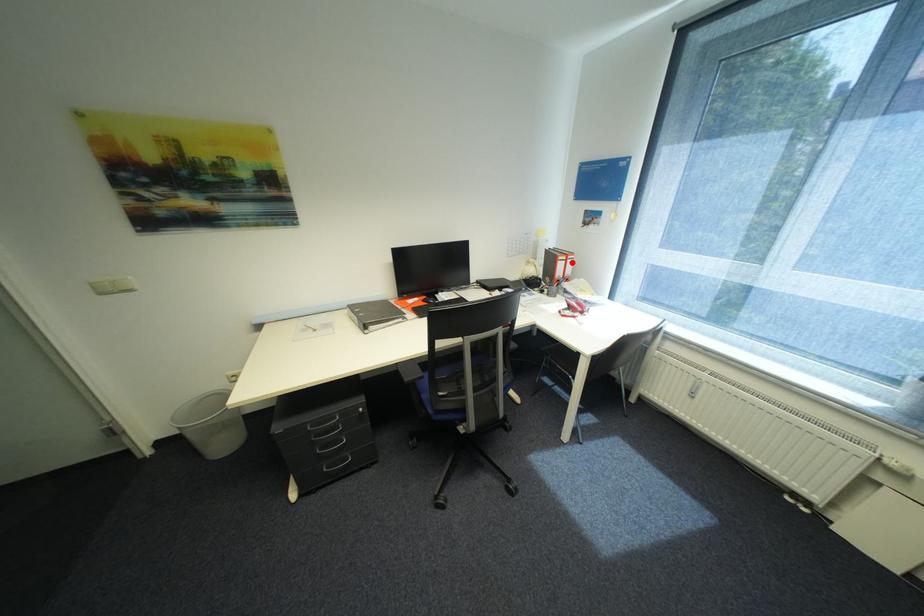
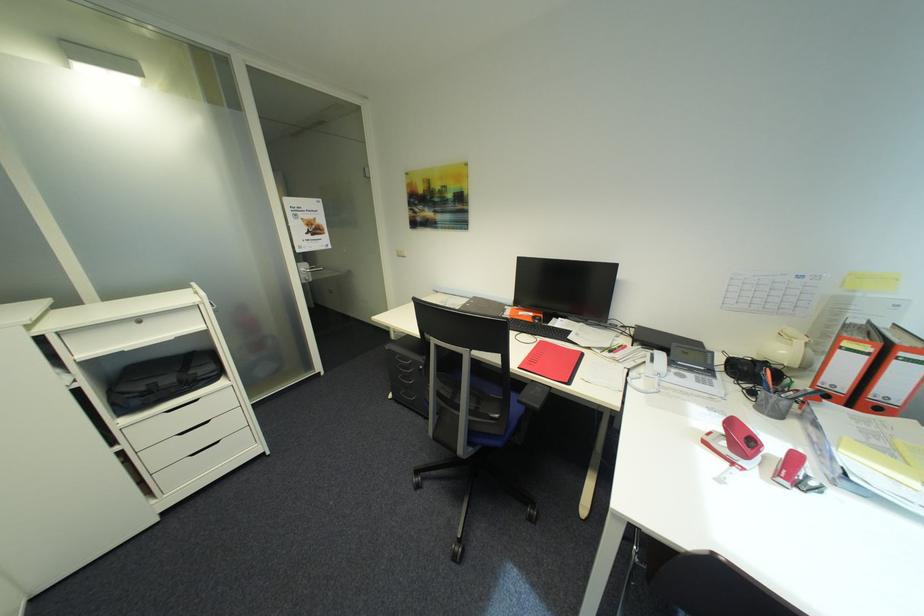
Question: I am providing you with two images of the same scene from different viewpoints. A red point is shown in image1. For the corresponding object point in image2, is it positioned nearer or farther from the camera?

Choices:
 (A) Nearer
 (B) Farther

Answer: (B)